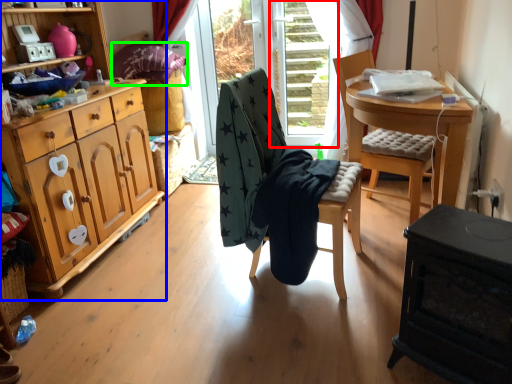
Question: Which object is positioned farthest from screen door (highlighted by a red box)? Select from cabinetry (highlighted by a blue box) and pillow (highlighted by a green box).

Choices:
 (A) cabinetry
 (B) pillow

Answer: (A)